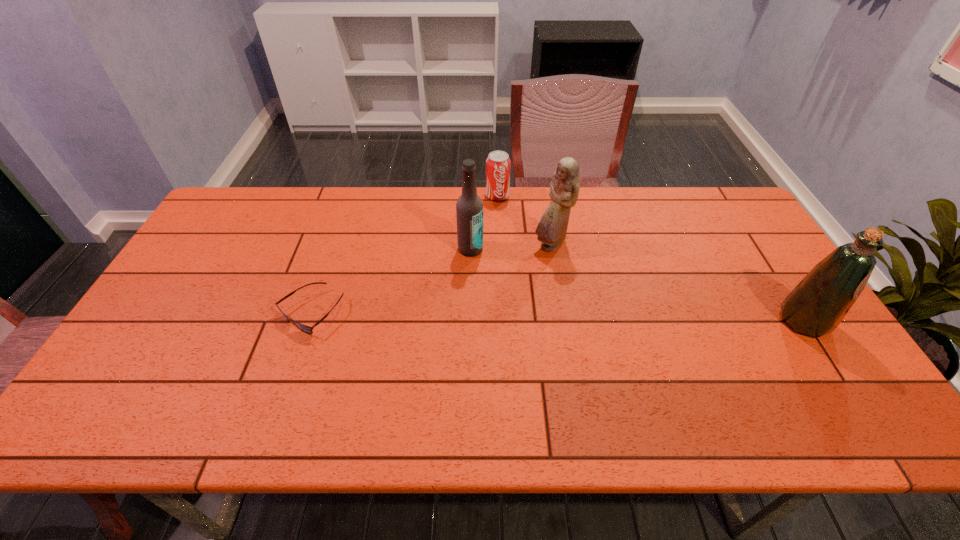
Identify the location of free space on the desktop that is between the sunglasses and the rightmost object and is positioned on the front-facing side of the figurine. Image resolution: width=960 pixels, height=540 pixels. (537, 316).

You are a GUI agent. You are given a task and a screenshot of the screen. Output one action in this format:
    pyautogui.click(x=<x>, y=<y>)
    Task: Click on the vacant space on the desktop that is between the leftmost object and the olive oil and is positioned on the logo side of the second shortest object
    This screenshot has width=960, height=540.
    Given the screenshot: What is the action you would take?
    pyautogui.click(x=529, y=316)

The width and height of the screenshot is (960, 540). I want to click on vacant space on the desktop that is between the sunglasses and the rightmost object and is positioned on the label of the fourth object from right to left, so click(498, 315).